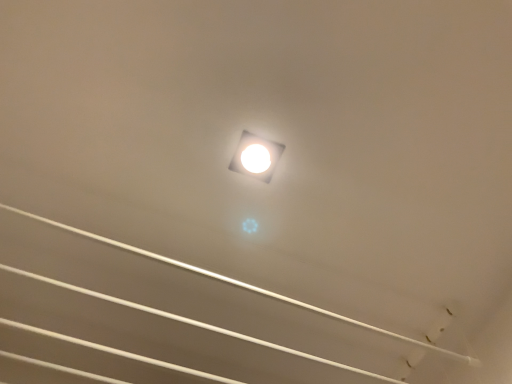
Describe the element at coordinates (256, 156) in the screenshot. I see `white glossy square at center` at that location.

The width and height of the screenshot is (512, 384). I want to click on white glossy square at center, so click(x=256, y=156).

Measure the distance between white glossy ceiling at center and camera.

white glossy ceiling at center is 27.17 inches from camera.

What do you see at coordinates (277, 296) in the screenshot?
I see `white glossy ceiling at center` at bounding box center [277, 296].

The height and width of the screenshot is (384, 512). What are the coordinates of `white glossy ceiling at center` in the screenshot? It's located at (277, 296).

In order to face white glossy ceiling at center, should I rotate leftwards or rightwards?

Turn left by 5.106 degrees to look at white glossy ceiling at center.

Identify the location of white glossy square at center. (256, 156).

Which is more to the right, white glossy ceiling at center or white glossy square at center?

Positioned to the right is white glossy square at center.

Based on the photo, is white glossy ceiling at center closer to the viewer compared to white glossy square at center?

Yes, white glossy ceiling at center is closer to the viewer.

Does point (79, 235) lie in front of point (272, 159)?

That is False.

From the image's perspective, is white glossy ceiling at center on white glossy square at center?

No, from the image's perspective, white glossy ceiling at center is not above white glossy square at center.

From a real-world perspective, relative to white glossy square at center, is white glossy ceiling at center vertically above or below?

In terms of real-world spatial position, white glossy ceiling at center is below white glossy square at center.

Does white glossy ceiling at center have a lesser width compared to white glossy square at center?

Incorrect, the width of white glossy ceiling at center is not less than that of white glossy square at center.

Consider the image. Who is shorter, white glossy ceiling at center or white glossy square at center?

With less height is white glossy square at center.

Which of these two, white glossy ceiling at center or white glossy square at center, is smaller?

With smaller size is white glossy square at center.

Would you say white glossy ceiling at center is outside white glossy square at center?

That's correct, white glossy ceiling at center is outside of white glossy square at center.

Is white glossy ceiling at center touching white glossy square at center?

No, white glossy ceiling at center is not in contact with white glossy square at center.

Is white glossy ceiling at center oriented away from white glossy square at center?

No, white glossy square at center is not at the back of white glossy ceiling at center.

What's the angular difference between white glossy ceiling at center and white glossy square at center's facing directions?

2.11 degrees separate the facing orientations of white glossy ceiling at center and white glossy square at center.

This screenshot has width=512, height=384. Identify the location of line located in front of the white glossy square at center. (277, 296).

Which object is positioned more to the right, white glossy square at center or white glossy ceiling at center?

white glossy square at center.

Which object is closer to the camera taking this photo, white glossy square at center or white glossy ceiling at center?

white glossy ceiling at center.

Is point (258, 142) behind point (280, 297)?

No.

From the image's perspective, would you say white glossy square at center is shown under white glossy ceiling at center?

Incorrect, from the image's perspective, white glossy square at center is higher than white glossy ceiling at center.

From a real-world perspective, between white glossy square at center and white glossy ceiling at center, who is vertically higher?

white glossy square at center is physically above.

Which object is wider, white glossy square at center or white glossy ceiling at center?

white glossy ceiling at center.

From their relative heights in the image, would you say white glossy square at center is taller or shorter than white glossy ceiling at center?

Clearly, white glossy square at center is shorter compared to white glossy ceiling at center.

Who is smaller, white glossy square at center or white glossy ceiling at center?

Smaller between the two is white glossy square at center.

Is white glossy square at center inside the boundaries of white glossy ceiling at center, or outside?

white glossy square at center is not enclosed by white glossy ceiling at center.

Is white glossy square at center with white glossy ceiling at center?

white glossy square at center and white glossy ceiling at center are not in contact.

Is white glossy square at center aimed at white glossy ceiling at center?

No.

Identify the location of lamp behind the white glossy ceiling at center. (x=256, y=156).

The width and height of the screenshot is (512, 384). I want to click on lamp above the white glossy ceiling at center (from the image's perspective), so click(x=256, y=156).

Where is `lamp above the white glossy ceiling at center (from a real-world perspective)`? lamp above the white glossy ceiling at center (from a real-world perspective) is located at coordinates (256, 156).